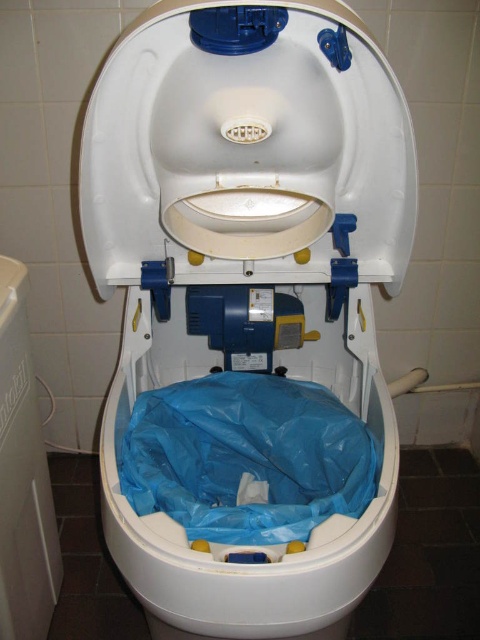
Question: Which object is the farthest from the white plastic toilet at center?

Choices:
 (A) white plastic toilet seat at center
 (B) blue plastic bag at center

Answer: (B)

Question: Among these objects, which one is nearest to the camera?

Choices:
 (A) white plastic toilet at center
 (B) blue plastic bag at center
 (C) white plastic toilet seat at center

Answer: (C)

Question: Does white plastic toilet at center come in front of white plastic toilet seat at center?

Choices:
 (A) yes
 (B) no

Answer: (B)

Question: Is white plastic toilet at center positioned at the back of white plastic toilet seat at center?

Choices:
 (A) no
 (B) yes

Answer: (B)

Question: Does white plastic toilet at center have a lesser width compared to white plastic toilet seat at center?

Choices:
 (A) no
 (B) yes

Answer: (A)

Question: Which point is farther to the camera?

Choices:
 (A) coord(352,109)
 (B) coord(298,468)

Answer: (B)